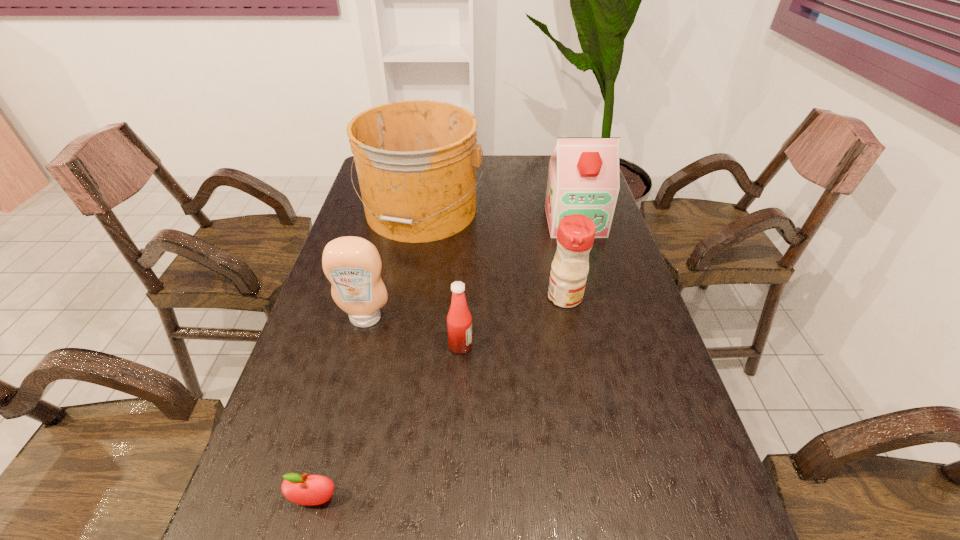
The height and width of the screenshot is (540, 960). In order to click on free space between the soya milk and the bucket in this screenshot , I will do `click(498, 216)`.

Identify the location of free space between the soya milk and the nearest object. The image size is (960, 540). (445, 361).

The height and width of the screenshot is (540, 960). I want to click on the third closest object to the shortest condiment, so click(x=416, y=160).

At what (x,y) coordinates should I click in order to perform the action: click on object that stands as the second closest to the second nearest object. Please return your answer as a coordinate pair (x, y). The height and width of the screenshot is (540, 960). Looking at the image, I should click on (575, 236).

Find the location of a particular element. This screenshot has width=960, height=540. condiment that is the second closest to the rightmost condiment is located at coordinates click(353, 266).

Locate which condiment is the third closest to the shortest object. Please provide its 2D coordinates. Your answer should be formatted as a tuple, i.e. [(x, y)], where the tuple contains the x and y coordinates of a point satisfying the conditions above.

[(575, 236)]

Identify the location of vacant position in the image that satisfies the following two spatial constraints: 1. with the cap open on the soya milk; 2. on the front-facing side of the second condiment from left to right. The height and width of the screenshot is (540, 960). (610, 346).